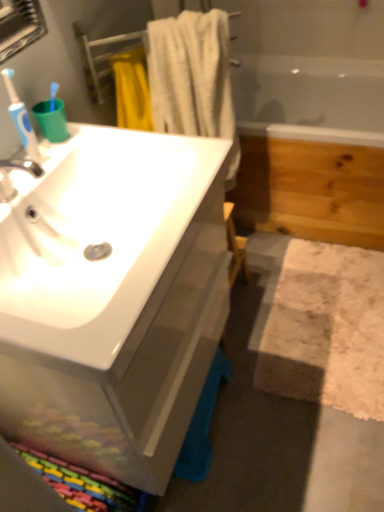
Question: In terms of width, does white cotton towel at upper center look wider or thinner when compared to wooden bathtub at right?

Choices:
 (A) wide
 (B) thin

Answer: (B)

Question: Considering the positions of point (228, 18) and point (254, 99), is point (228, 18) closer or farther from the camera than point (254, 99)?

Choices:
 (A) farther
 (B) closer

Answer: (B)

Question: Which is nearer to the white textured bath mat at lower right?

Choices:
 (A) white glossy sink at left
 (B) wooden bathtub at right
 (C) white cotton towel at upper center
 (D) blue plastic toothbrush at left

Answer: (A)

Question: Which object is positioned farthest from the white glossy sink at left?

Choices:
 (A) white cotton towel at upper center
 (B) white textured bath mat at lower right
 (C) wooden bathtub at right
 (D) blue plastic toothbrush at left

Answer: (C)